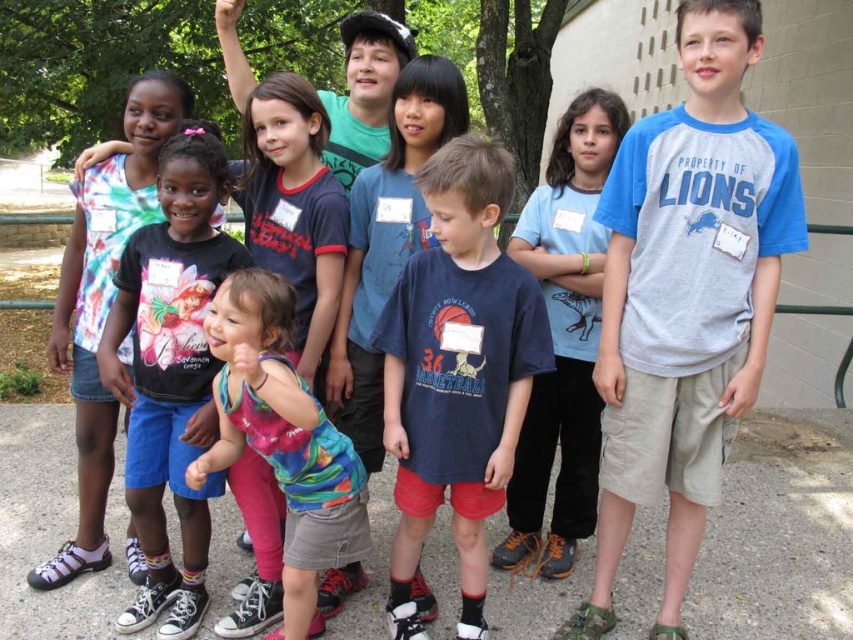
Does gray cotton t-shirt at center appear under tie-dye fabric shirt at left?

Correct, gray cotton t-shirt at center is located below tie-dye fabric shirt at left.

Between gray cotton t-shirt at center and tie-dye fabric shirt at left, which one appears on the right side from the viewer's perspective?

From the viewer's perspective, gray cotton t-shirt at center appears more on the right side.

Which is in front, point (708, 388) or point (96, 493)?

Point (708, 388) is more forward.

This screenshot has height=640, width=853. In order to click on gray cotton t-shirt at center in this screenshot , I will do `click(686, 298)`.

Is point (778, 198) positioned behind point (312, 428)?

That is True.

Is gray cotton t-shirt at center taller than multicolored fabric dress at center?

Yes.

Find the location of `gray cotton t-shirt at center`. gray cotton t-shirt at center is located at coordinates (686, 298).

I want to click on gray cotton t-shirt at center, so click(686, 298).

Is dark blue t-shirt at center thinner than tie-dye fabric shirt at left?

Indeed, dark blue t-shirt at center has a lesser width compared to tie-dye fabric shirt at left.

Which of these two, dark blue t-shirt at center or tie-dye fabric shirt at left, stands taller?

With more height is tie-dye fabric shirt at left.

Who is more forward, (439, 269) or (103, 172)?

Point (439, 269)

Find the location of a particular element. Image resolution: width=853 pixels, height=640 pixels. dark blue t-shirt at center is located at coordinates (457, 372).